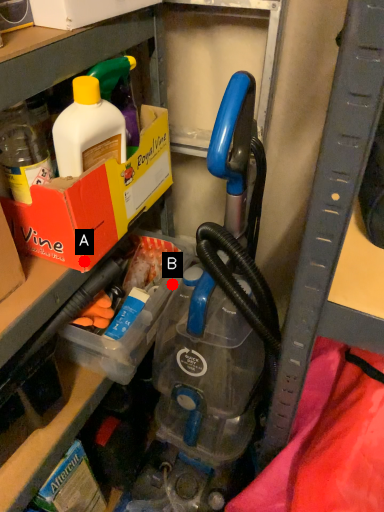
Question: Two points are circled on the image, labeled by A and B beside each circle. Which point is closer to the camera?

Choices:
 (A) A is closer
 (B) B is closer

Answer: (A)